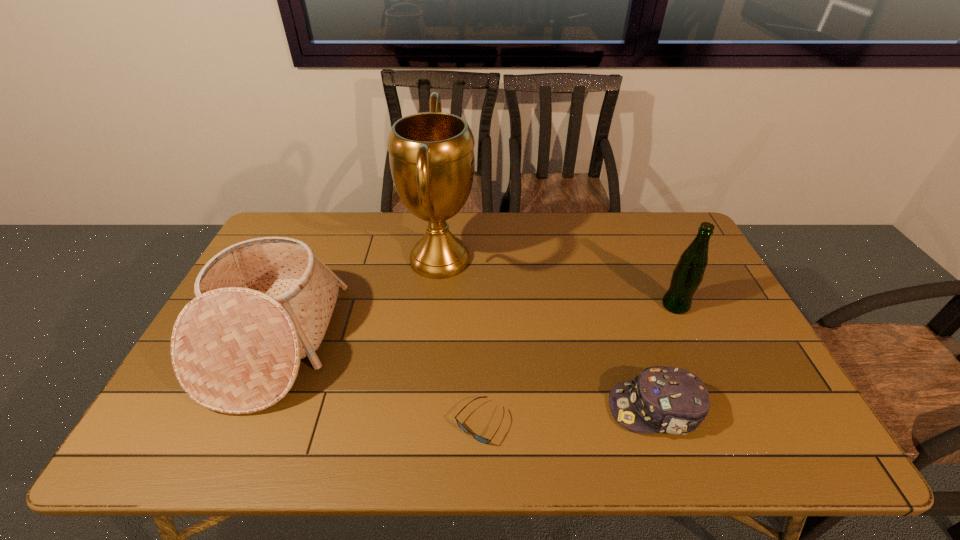
Image resolution: width=960 pixels, height=540 pixels. In order to click on the tallest object in this screenshot , I will do `click(431, 155)`.

The width and height of the screenshot is (960, 540). I want to click on beer bottle, so click(688, 273).

This screenshot has height=540, width=960. What are the coordinates of `the leftmost object` in the screenshot? It's located at (263, 304).

Where is `the third shortest object`? The image size is (960, 540). the third shortest object is located at coordinates (263, 304).

The height and width of the screenshot is (540, 960). What are the coordinates of `headwear` in the screenshot? It's located at (669, 400).

Find the location of a particular element. This screenshot has width=960, height=540. the fourth tallest object is located at coordinates tap(669, 400).

Where is `sunglasses`? The image size is (960, 540). sunglasses is located at coordinates (481, 439).

Locate an element on the screen. Image resolution: width=960 pixels, height=540 pixels. vacant region located 0.380m on the surface of the tallest object with symbols is located at coordinates (592, 259).

Locate an element on the screen. vacant space located 0.220m on the back of the beer bottle is located at coordinates (650, 250).

Where is `free space located 0.280m with the lid open on the leftmost object`? free space located 0.280m with the lid open on the leftmost object is located at coordinates (435, 342).